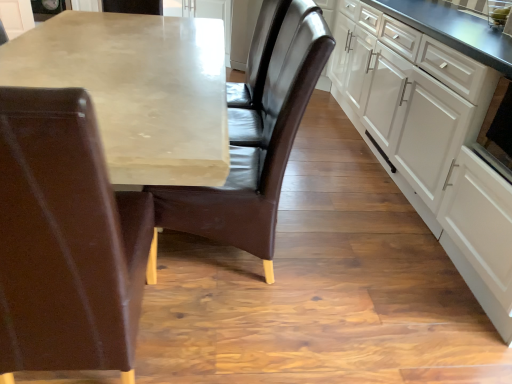
The width and height of the screenshot is (512, 384). What are the coordinates of `spots to the right of brown leather chair at center, which is counted as the 1th chair, starting from the right` in the screenshot? It's located at (337, 274).